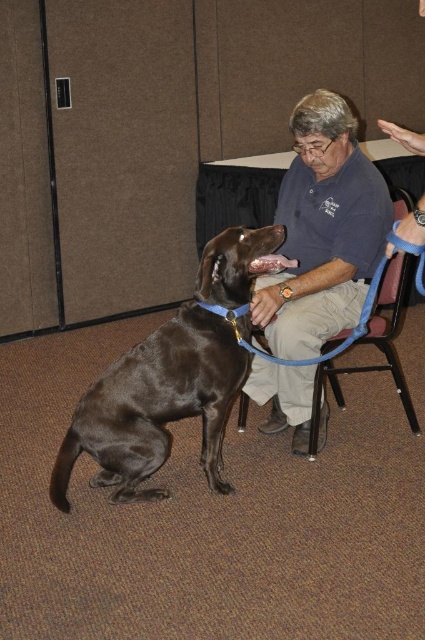
Question: Is shiny brown dog at center positioned at the back of matte blue shirt at center?

Choices:
 (A) no
 (B) yes

Answer: (A)

Question: Which point is closer to the camera?

Choices:
 (A) shiny brown dog at center
 (B) matte blue shirt at center

Answer: (A)

Question: Among these objects, which one is nearest to the camera?

Choices:
 (A) matte blue shirt at center
 (B) shiny brown dog at center

Answer: (B)

Question: Can you confirm if shiny brown dog at center is positioned to the left of matte blue shirt at center?

Choices:
 (A) yes
 (B) no

Answer: (A)

Question: Can you confirm if shiny brown dog at center is positioned below matte blue shirt at center?

Choices:
 (A) no
 (B) yes

Answer: (B)